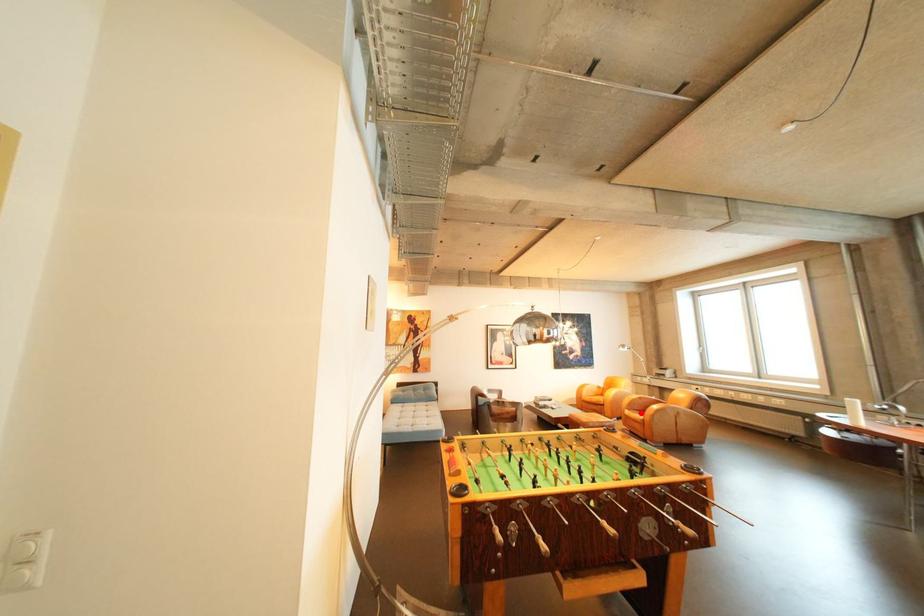
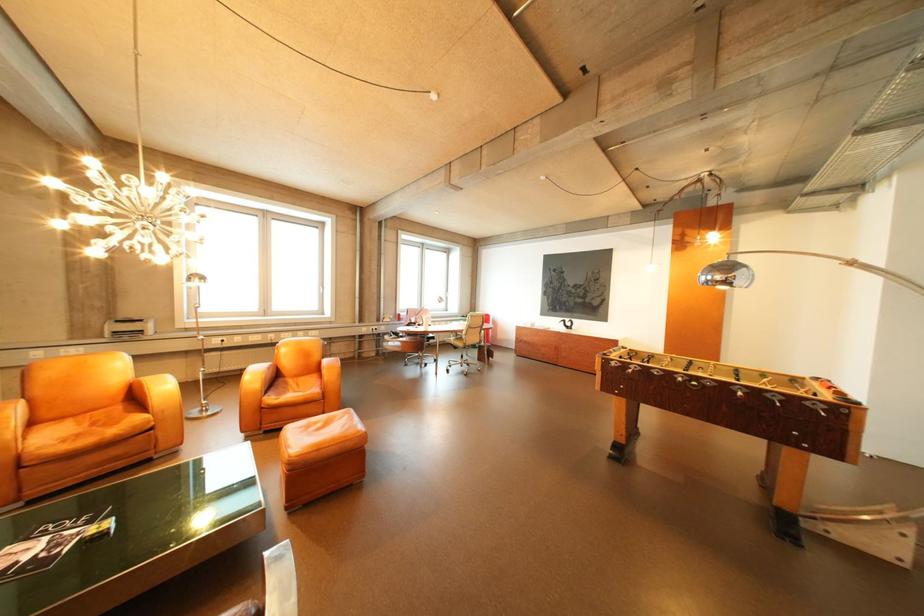
Find the pixel in the second image that matches the highlighted location in the first image.

(285, 400)